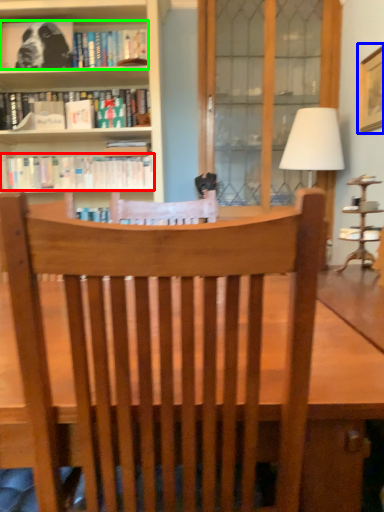
Question: Estimate the real-world distances between objects in this image. Which object is closer to book (highlighted by a red box), picture frame (highlighted by a blue box) or book (highlighted by a green box)?

Choices:
 (A) picture frame
 (B) book

Answer: (B)